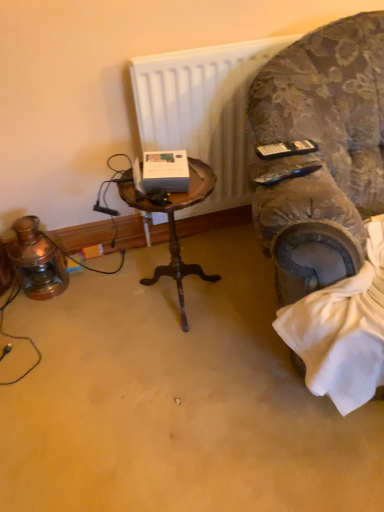
What is the approximate height of woodenobject at center?

21.84 inches.

You are a GUI agent. You are given a task and a screenshot of the screen. Output one action in this format:
    pyautogui.click(x=<x>, y=<y>)
    Task: Click on the woodenobject at center
    This screenshot has height=512, width=384.
    Given the screenshot: What is the action you would take?
    pyautogui.click(x=175, y=226)

Is velvet-patterned armchair at right wider than white matte radiator at upper center?

Yes, velvet-patterned armchair at right is wider than white matte radiator at upper center.

Is white matte radiator at upper center surrounded by velvet-patterned armchair at right?

That's incorrect, white matte radiator at upper center is not inside velvet-patterned armchair at right.

Looking at this image, is velvet-patterned armchair at right positioned with its back to white matte radiator at upper center?

No, white matte radiator at upper center is not at the back of velvet-patterned armchair at right.

Between velvet-patterned armchair at right and woodenobject at center, which one is positioned behind?

woodenobject at center is behind.

Is woodenobject at center at the back of velvet-patterned armchair at right?

velvet-patterned armchair at right is not turned away from woodenobject at center.

Is the surface of velvet-patterned armchair at right in direct contact with woodenobject at center?

velvet-patterned armchair at right and woodenobject at center are not in contact.

Is velvet-patterned armchair at right outside of woodenobject at center?

Yes, velvet-patterned armchair at right is outside of woodenobject at center.

Consider the image. Is white matte radiator at upper center positioned with its back to woodenobject at center?

No.

Does white matte radiator at upper center have a greater width compared to woodenobject at center?

In fact, white matte radiator at upper center might be narrower than woodenobject at center.

From a real-world perspective, is white matte radiator at upper center under woodenobject at center?

No, from a real-world perspective, white matte radiator at upper center is not beneath woodenobject at center.

Identify the location of table in front of the white matte radiator at upper center. The width and height of the screenshot is (384, 512). (175, 226).

From a real-world perspective, is woodenobject at center above or below velvet-patterned armchair at right?

woodenobject at center is situated lower than velvet-patterned armchair at right in the real world.

Which is in front, point (176, 282) or point (333, 225)?

Positioned in front is point (333, 225).

Which object is positioned more to the right, woodenobject at center or velvet-patterned armchair at right?

Positioned to the right is velvet-patterned armchair at right.

Who is taller, woodenobject at center or velvet-patterned armchair at right?

Standing taller between the two is velvet-patterned armchair at right.

Can we say woodenobject at center lies outside white matte radiator at upper center?

woodenobject at center is positioned outside white matte radiator at upper center.

Considering the sizes of objects woodenobject at center and white matte radiator at upper center in the image provided, who is taller, woodenobject at center or white matte radiator at upper center?

white matte radiator at upper center is taller.

From a real-world perspective, is woodenobject at center under white matte radiator at upper center?

Yes, from a real-world perspective, woodenobject at center is under white matte radiator at upper center.

Can you tell me how much white matte radiator at upper center and velvet-patterned armchair at right differ in facing direction?

The angular difference between white matte radiator at upper center and velvet-patterned armchair at right is 14.7 degrees.

Which of these two, white matte radiator at upper center or velvet-patterned armchair at right, stands shorter?

white matte radiator at upper center is shorter.

Does white matte radiator at upper center have a larger size compared to velvet-patterned armchair at right?

No, white matte radiator at upper center is not bigger than velvet-patterned armchair at right.

Find the location of a particular element. The height and width of the screenshot is (512, 384). radiator behind the velvet-patterned armchair at right is located at coordinates (202, 109).

At what (x,y) coordinates should I click in order to perform the action: click on radiator on the left of the velvet-patterned armchair at right. Please return your answer as a coordinate pair (x, y). This screenshot has width=384, height=512. Looking at the image, I should click on pos(202,109).

In the image, there is a woodenobject at center. Find the location of `chair above it (from the image's perspective)`. chair above it (from the image's perspective) is located at coordinates (322, 151).

When comparing their distances from velvet-patterned armchair at right, does woodenobject at center or white matte radiator at upper center seem closer?

white matte radiator at upper center is closer to velvet-patterned armchair at right.

Looking at the image, which one is located closer to white matte radiator at upper center, woodenobject at center or velvet-patterned armchair at right?

velvet-patterned armchair at right.

Based on their spatial positions, is velvet-patterned armchair at right or woodenobject at center further from white matte radiator at upper center?

Based on the image, woodenobject at center appears to be further to white matte radiator at upper center.

From the image, which object appears to be nearer to velvet-patterned armchair at right, white matte radiator at upper center or woodenobject at center?

white matte radiator at upper center lies closer to velvet-patterned armchair at right than the other object.

Estimate the real-world distances between objects in this image. Which object is closer to woodenobject at center, velvet-patterned armchair at right or white matte radiator at upper center?

Among the two, white matte radiator at upper center is located nearer to woodenobject at center.

Considering their positions, is white matte radiator at upper center positioned closer to woodenobject at center than velvet-patterned armchair at right?

white matte radiator at upper center.

The image size is (384, 512). I want to click on table between velvet-patterned armchair at right and white matte radiator at upper center in the front-back direction, so click(x=175, y=226).